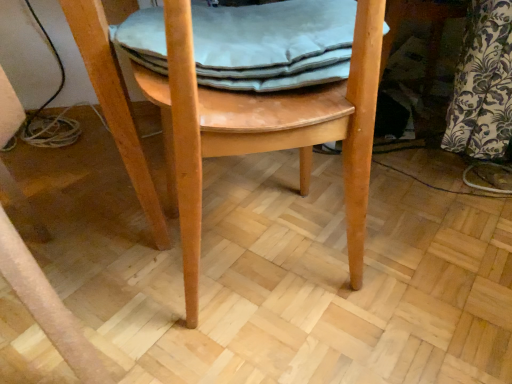
The width and height of the screenshot is (512, 384). In order to click on free location to the right of light brown wood chair at center in this screenshot , I will do (x=398, y=261).